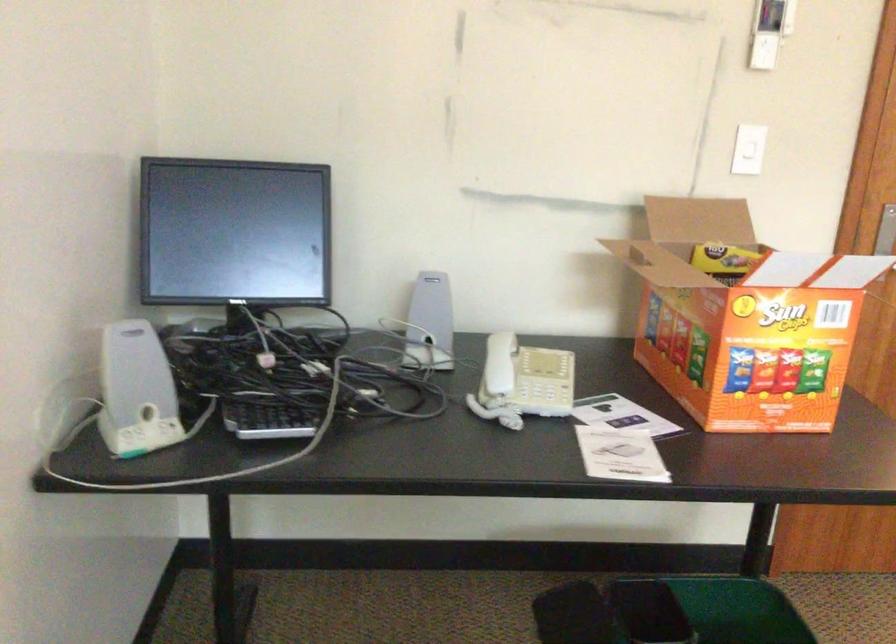
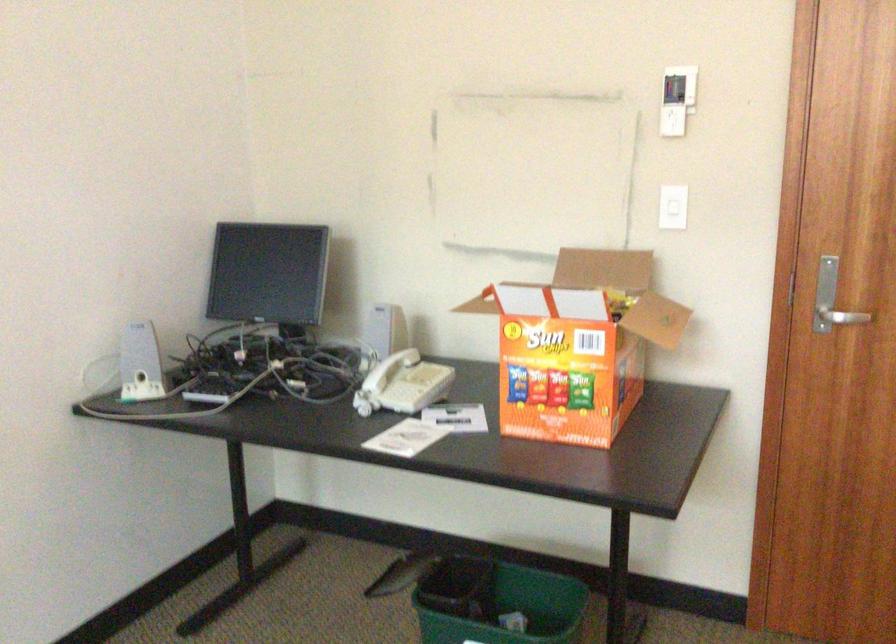
Locate, in the second image, the point that corresponds to point 803,313 in the first image.

(578, 345)